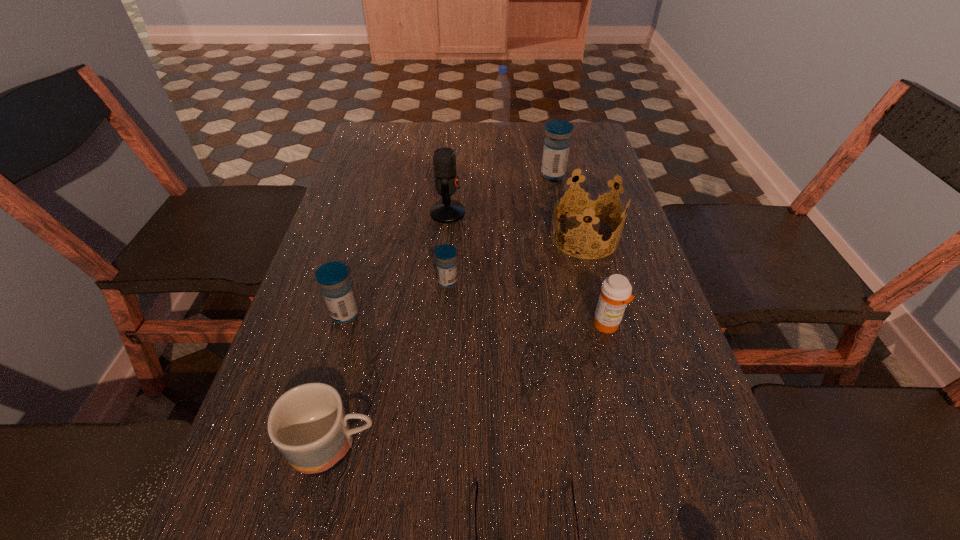
Locate an element on the screen. Image resolution: width=960 pixels, height=540 pixels. the eighth farthest object is located at coordinates (308, 424).

Where is `the shortest medicine`? This screenshot has height=540, width=960. the shortest medicine is located at coordinates (446, 263).

Where is `the second nearest blue medicine`? This screenshot has height=540, width=960. the second nearest blue medicine is located at coordinates (446, 263).

Locate an element on the screen. vacant space situated 0.280m on the right of the blue bottle is located at coordinates (593, 126).

What are the coordinates of `vacant region located 0.120m on the side of the microphone with the red ring` in the screenshot? It's located at (512, 213).

This screenshot has height=540, width=960. In order to click on free region located 0.060m on the right of the eighth nearest object in this screenshot , I will do `click(587, 175)`.

Find the location of a particular element. Image resolution: width=960 pixels, height=540 pixels. free space located on the front of the crown is located at coordinates (614, 353).

Locate an element on the screen. The image size is (960, 540). vacant space situated 0.180m on the front of the leftmost blue medicine is located at coordinates (319, 409).

Locate an element on the screen. The width and height of the screenshot is (960, 540). free space located on the back of the orange medicine is located at coordinates (581, 224).

You are a GUI agent. You are given a task and a screenshot of the screen. Output one action in this format:
    pyautogui.click(x=<x>, y=<y>)
    Task: Click on the free location located on the side with the handle of the mug
    Image resolution: width=960 pixels, height=540 pixels.
    Given the screenshot: What is the action you would take?
    pyautogui.click(x=492, y=444)